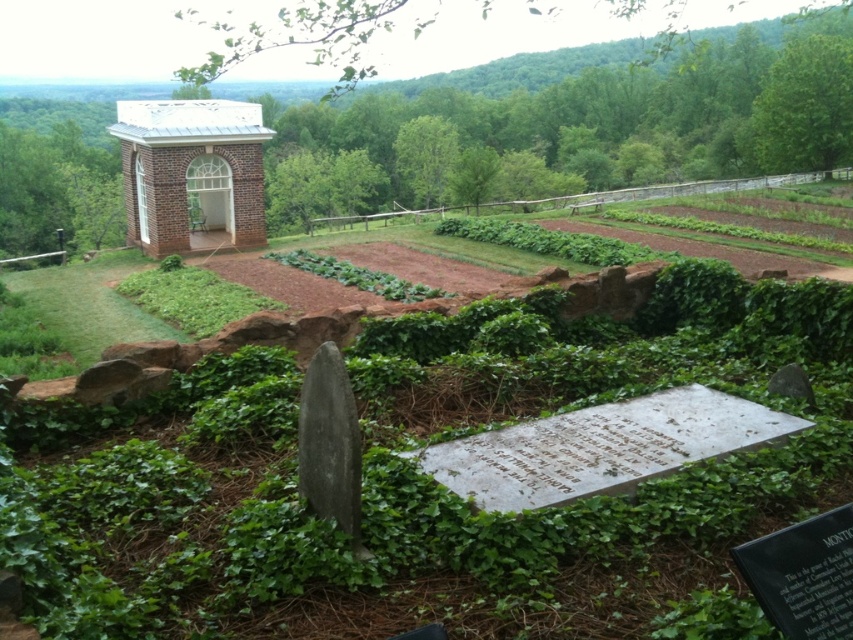
Is green leafy plants at center further to camera compared to white brick chapel at upper left?

No, it is in front of white brick chapel at upper left.

Is green leafy plants at center shorter than white brick chapel at upper left?

No.

Between point (838, 60) and point (247, 172), which one is positioned behind?

Point (838, 60)

Locate an element on the screen. The width and height of the screenshot is (853, 640). green leafy plants at center is located at coordinates (564, 129).